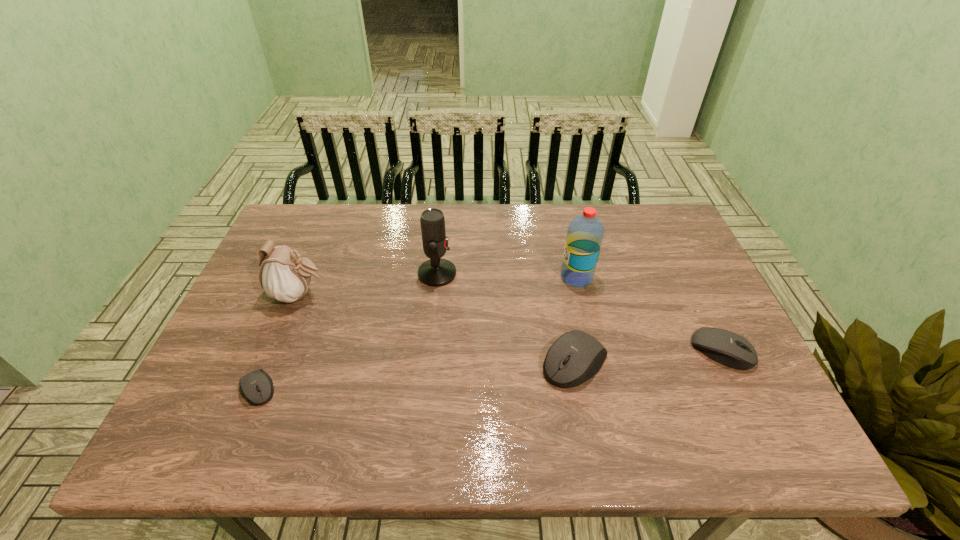
At what (x,y) coordinates should I click in order to perform the action: click on vacant space located 0.110m on the back of the rightmost object. Please return your answer as a coordinate pair (x, y). Looking at the image, I should click on (697, 299).

I want to click on vacant space located on the side of the microphone with the red ring, so click(591, 273).

In order to click on blank area located on the front label of the water bottle in this screenshot , I will do `click(491, 277)`.

Find the location of a particular element. The image size is (960, 540). free spot located on the front label of the water bottle is located at coordinates (480, 277).

The image size is (960, 540). In order to click on blank space located on the front label of the water bottle in this screenshot , I will do `click(445, 277)`.

Find the location of `free space located on the front-facing side of the pouch`. free space located on the front-facing side of the pouch is located at coordinates click(x=408, y=295).

Locate an element on the screen. This screenshot has width=960, height=540. computer equipment that is positioned at the left edge is located at coordinates (257, 386).

Where is `pouch at the left edge`? The height and width of the screenshot is (540, 960). pouch at the left edge is located at coordinates (285, 276).

Identify the location of object at the right edge. The height and width of the screenshot is (540, 960). (726, 347).

You are a GUI agent. You are given a task and a screenshot of the screen. Output one action in this format:
    pyautogui.click(x=<x>, y=<y>)
    Task: Click on the object located in the near left corner section of the desktop
    The width and height of the screenshot is (960, 540).
    Given the screenshot: What is the action you would take?
    pyautogui.click(x=257, y=386)